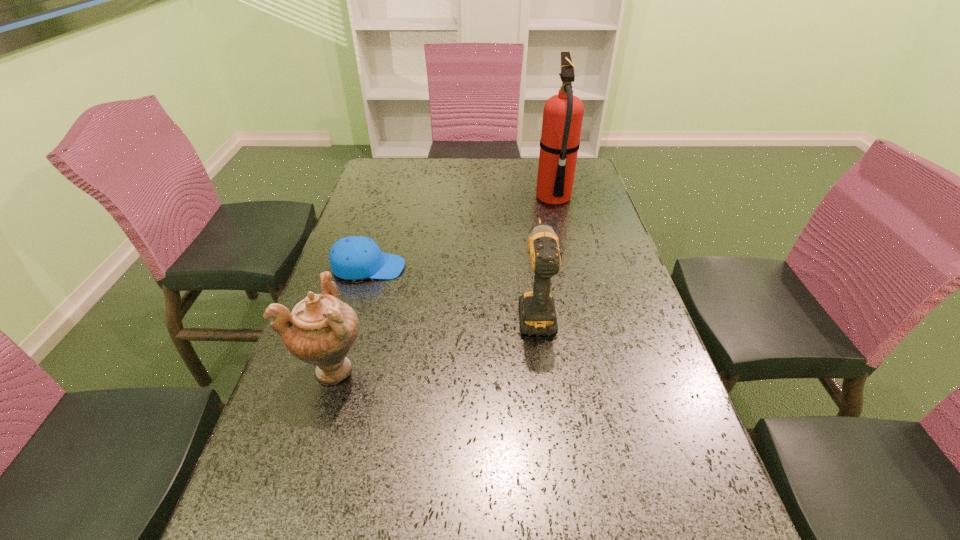
Where is `the tallest object`? The image size is (960, 540). the tallest object is located at coordinates (563, 113).

I want to click on the farthest object, so click(563, 113).

I want to click on the third object from left to right, so pyautogui.click(x=537, y=312).

Locate an element on the screen. This screenshot has width=960, height=540. urn is located at coordinates pos(321,330).

At what (x,y) coordinates should I click in order to perform the action: click on the second farthest object. Please return your answer as a coordinate pair (x, y). The image size is (960, 540). Looking at the image, I should click on (351, 258).

I want to click on cap, so click(351, 258).

At what (x,y) coordinates should I click in order to perform the action: click on vacant space located at the nozzle of the farthest object. Please return your answer as a coordinate pair (x, y). Image resolution: width=960 pixels, height=540 pixels. Looking at the image, I should click on (445, 198).

Identify the location of vacant region located at the nozzle of the farthest object. Image resolution: width=960 pixels, height=540 pixels. (481, 198).

The width and height of the screenshot is (960, 540). What are the coordinates of `free location located 0.380m at the nozzle of the farthest object` in the screenshot? It's located at (421, 198).

Where is `vacant area located 0.370m with the drill bit of the third object from left to right facing forward`? vacant area located 0.370m with the drill bit of the third object from left to right facing forward is located at coordinates (522, 208).